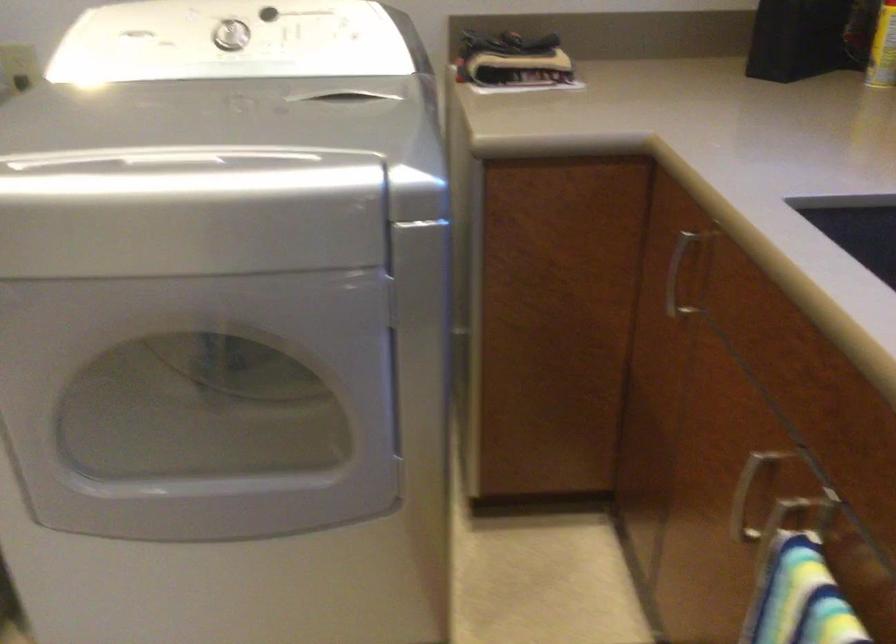
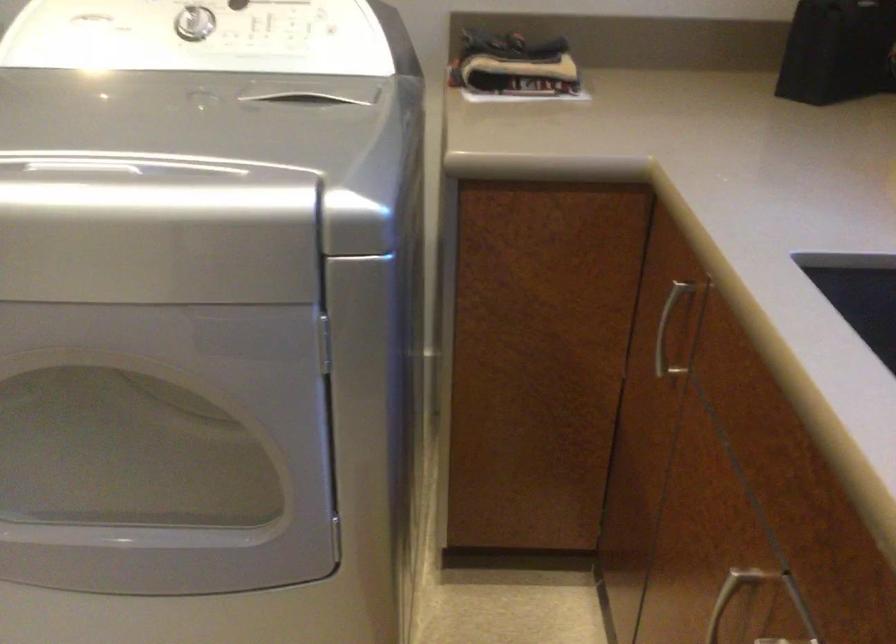
Question: The camera is either moving clockwise (left) or counter-clockwise (right) around the object. The first image is from the beginning of the video and the second image is from the end. Is the camera moving left or right when shooting the video?

Choices:
 (A) Left
 (B) Right

Answer: (B)